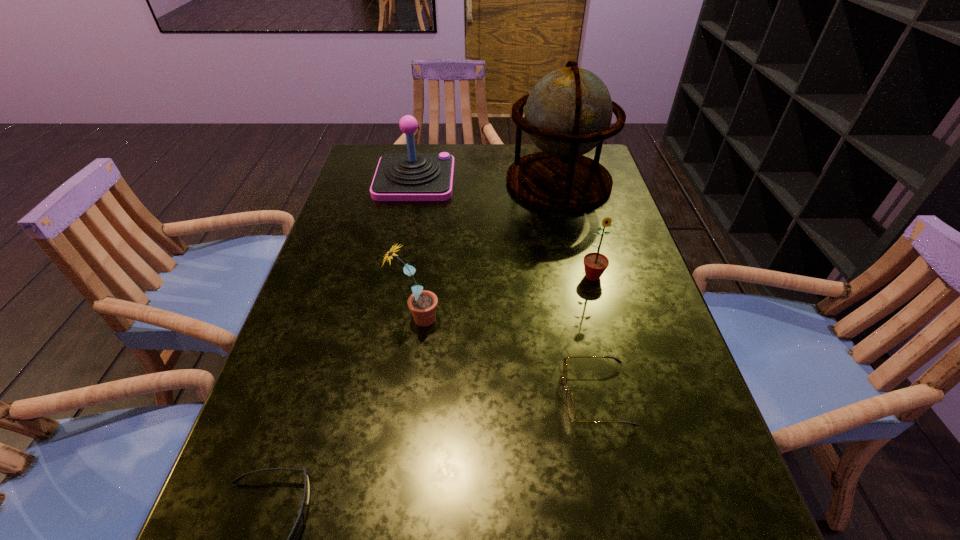
In order to click on sunglasses at the right edge in this screenshot , I will do `click(570, 403)`.

Where is `object that is positioned at the far left corner`? The width and height of the screenshot is (960, 540). object that is positioned at the far left corner is located at coordinates (411, 176).

I want to click on object located at the far right corner, so click(568, 113).

Identify the location of vacant space at the far edge of the desktop. This screenshot has height=540, width=960. (522, 153).

In order to click on vacant space at the left edge in this screenshot , I will do `click(390, 224)`.

This screenshot has width=960, height=540. Find the location of `vacant region at the right edge of the desktop`. vacant region at the right edge of the desktop is located at coordinates (588, 225).

Find the location of a particular element. The width and height of the screenshot is (960, 540). vacant area at the far left corner of the desktop is located at coordinates (361, 168).

Identify the location of free area in between the left sunflower and the taller sunglasses. The width and height of the screenshot is (960, 540). (506, 357).

Identify the location of vacant area that lies between the tallest object and the fifth tallest object. This screenshot has width=960, height=540. (577, 289).

The height and width of the screenshot is (540, 960). What are the coordinates of `unoccupied position between the left sunflower and the right sunflower` in the screenshot? It's located at (504, 298).